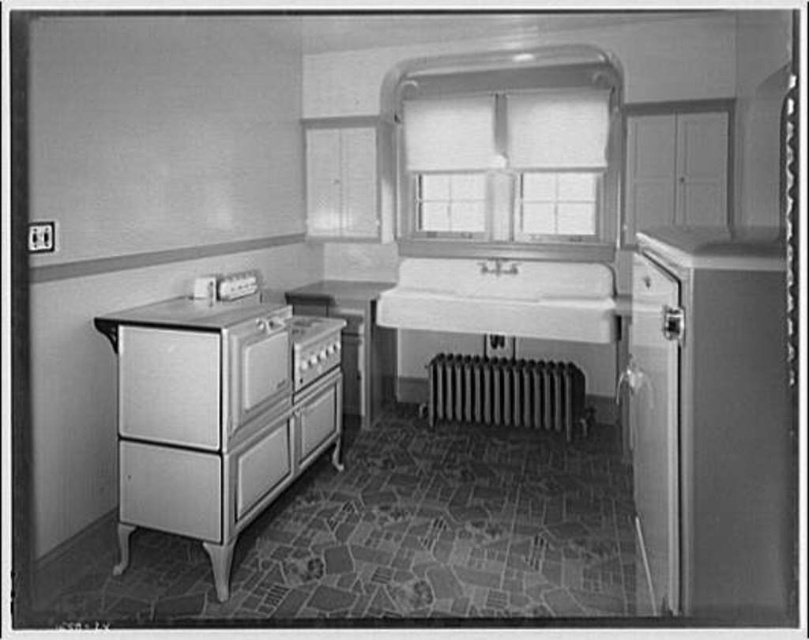
Who is shorter, white porcelain sink at center or white glossy drawer at lower left?

With less height is white glossy drawer at lower left.

Consider the image. Does white porcelain sink at center have a greater height compared to white glossy drawer at lower left?

Yes, white porcelain sink at center is taller than white glossy drawer at lower left.

Is point (532, 317) positioned behind point (236, 496)?

That is True.

Identify the location of white porcelain sink at center. This screenshot has height=640, width=809. (502, 298).

Is metallic refrigerator at right bigger than white textured window at center?

No.

Image resolution: width=809 pixels, height=640 pixels. Find the location of `metallic refrigerator at right`. metallic refrigerator at right is located at coordinates (716, 422).

Is metallic refrigerator at right below metallic silver drawer at lower left?

No.

Does metallic refrigerator at right appear on the right side of metallic silver drawer at lower left?

Yes, metallic refrigerator at right is to the right of metallic silver drawer at lower left.

Where is `metallic refrigerator at right`? The width and height of the screenshot is (809, 640). metallic refrigerator at right is located at coordinates (716, 422).